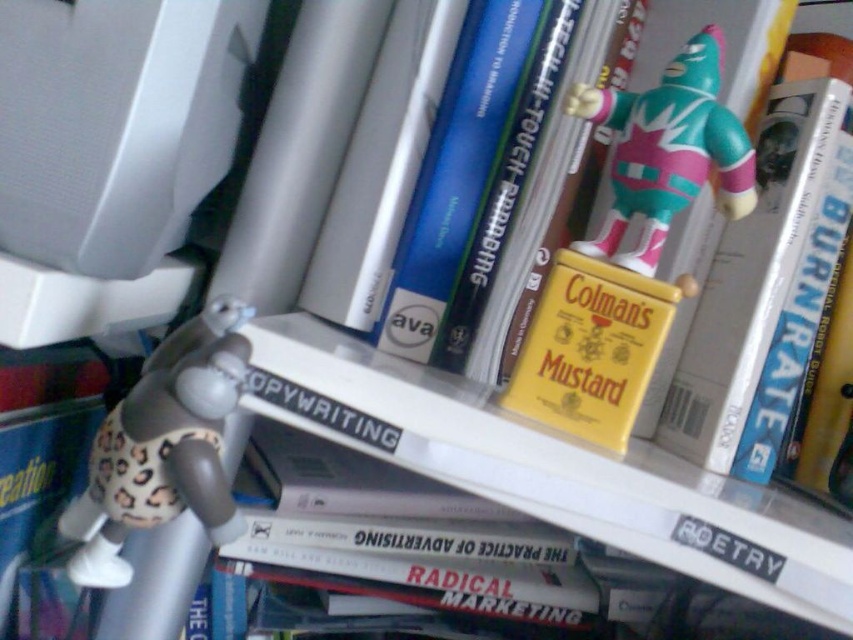
Question: Can you confirm if yellow matte mustard container at upper right is bigger than yellow matte mustard container at center?

Choices:
 (A) yes
 (B) no

Answer: (A)

Question: Is yellow matte mustard container at upper right to the right of yellow matte mustard container at center from the viewer's perspective?

Choices:
 (A) no
 (B) yes

Answer: (B)

Question: From the image, what is the correct spatial relationship of leopard print fabric monkey at lower left in relation to yellow matte mustard container at center?

Choices:
 (A) below
 (B) above

Answer: (A)

Question: Among these points, which one is nearest to the camera?

Choices:
 (A) (180, 340)
 (B) (810, 209)
 (C) (589, 358)
 (D) (641, 120)

Answer: (A)

Question: Which point is farther to the camera?

Choices:
 (A) teal and pink plastic figure at upper right
 (B) yellow matte mustard container at center
 (C) yellow matte mustard container at upper right
 (D) leopard print fabric monkey at lower left

Answer: (C)

Question: Which point appears closest to the camera in this image?

Choices:
 (A) (705, 337)
 (B) (132, 419)

Answer: (B)